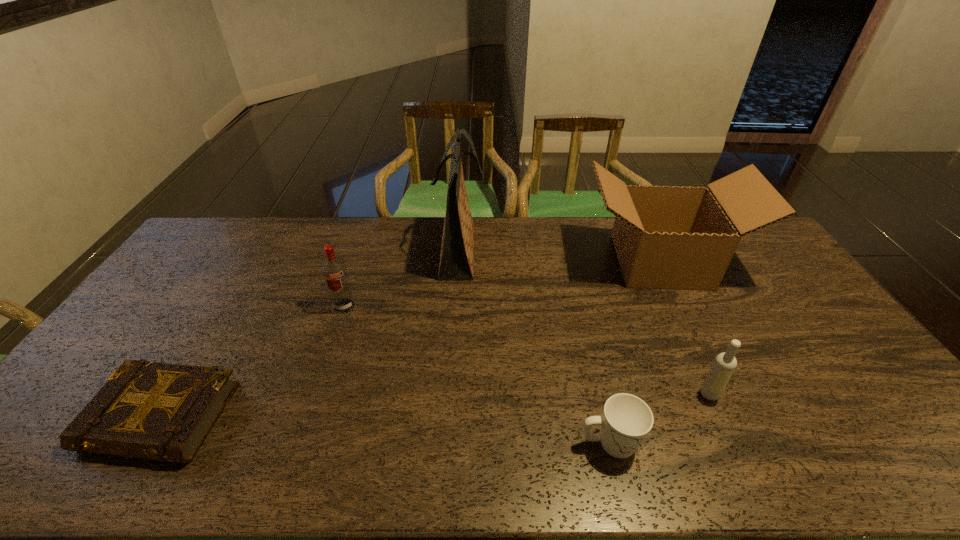
At what (x,y) coordinates should I click in order to perform the action: click on vacant area between the fifth tallest object and the second tallest object. Please return your answer as a coordinate pair (x, y). The image size is (960, 540). Looking at the image, I should click on (635, 353).

Find the location of a particular element. free space between the right vodka and the fifth tallest object is located at coordinates (660, 418).

This screenshot has width=960, height=540. I want to click on free space between the second tallest object and the mug, so click(x=635, y=353).

Locate an element on the screen. vacant space in between the hardback book and the shopping bag is located at coordinates (310, 334).

Identify the location of free area in between the fourth object from right to left and the right vodka. The image size is (960, 540). (585, 322).

Find the location of a particular element. free space between the shortest object and the fifth tallest object is located at coordinates (386, 430).

Locate an element on the screen. free spot between the fourth nearest object and the second shortest object is located at coordinates (477, 375).

At what (x,y) coordinates should I click in order to perform the action: click on vacant point located between the shortest object and the mug. Please return your answer as a coordinate pair (x, y). The height and width of the screenshot is (540, 960). Looking at the image, I should click on (386, 430).

At what (x,y) coordinates should I click in order to perform the action: click on vacant region between the tallest object and the box. Please return your answer as a coordinate pair (x, y). Looking at the image, I should click on (560, 256).

Identify which object is located as the second nearest to the leftmost object. Please provide its 2D coordinates. Your answer should be formatted as a tuple, i.e. [(x, y)], where the tuple contains the x and y coordinates of a point satisfying the conditions above.

[(457, 249)]